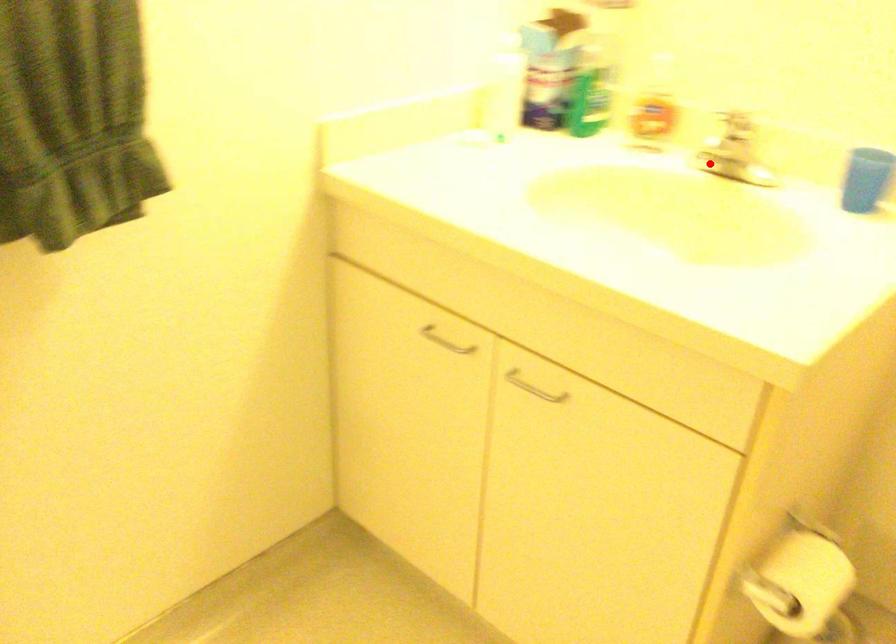
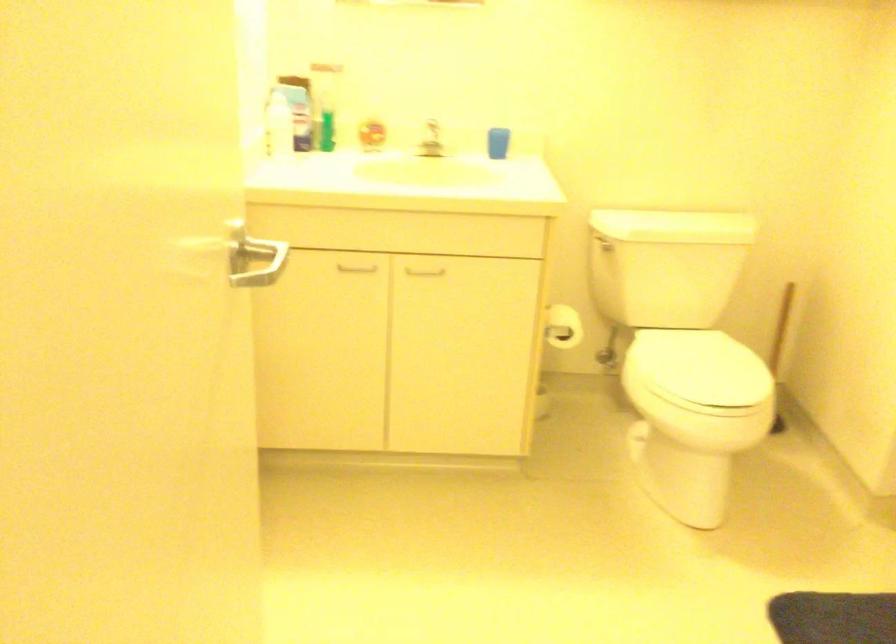
Question: A red point is marked in image1. In image2, is the corresponding 3D point closer to the camera or farther? Reply with the corresponding letter.

Choices:
 (A) The corresponding 3D point is closer.
 (B) The corresponding 3D point is farther.

Answer: (B)